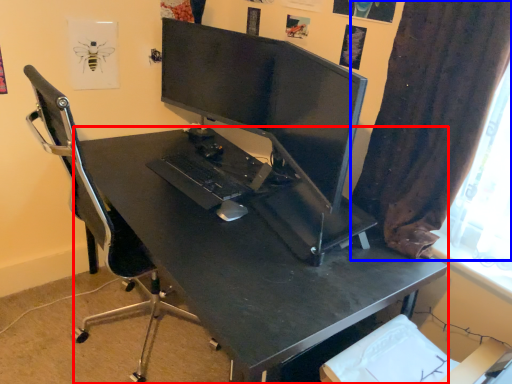
Question: Which object is further to the camera taking this photo, desk (highlighted by a red box) or curtain (highlighted by a blue box)?

Choices:
 (A) desk
 (B) curtain

Answer: (A)